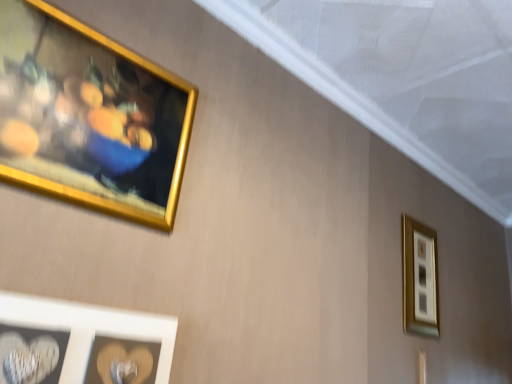
Question: From the image's perspective, is gold metallic picture frame at upper left, which is the 1th picture frame from left to right, positioned above or below white matte heart at lower left, which is the 1th picture frame in front-to-back order?

Choices:
 (A) above
 (B) below

Answer: (A)

Question: In the image, is gold metallic picture frame at upper left, which is the second picture frame in front-to-back order, on the left side or the right side of white matte heart at lower left, which appears as the second picture frame when viewed from the left?

Choices:
 (A) right
 (B) left

Answer: (B)

Question: Based on their relative distances, which object is nearer to the gold metallic picture frame at upper left, which is the 1th picture frame from left to right?

Choices:
 (A) white matte heart at lower left, which is the 2th picture frame from right to left
 (B) gold metallic picture frame at upper right, the third picture frame when ordered from front to back

Answer: (A)

Question: Considering the real-world distances, which object is farthest from the gold metallic picture frame at upper right, the 3th picture frame in the left-to-right sequence?

Choices:
 (A) white matte heart at lower left, which is the 1th picture frame in front-to-back order
 (B) gold metallic picture frame at upper left, which is the second picture frame in front-to-back order

Answer: (B)